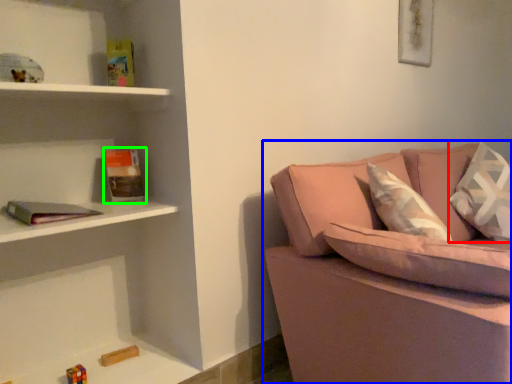
Question: Considering the real-world distances, which object is farthest from pillow (highlighted by a red box)? studio couch (highlighted by a blue box) or book (highlighted by a green box)?

Choices:
 (A) studio couch
 (B) book

Answer: (B)